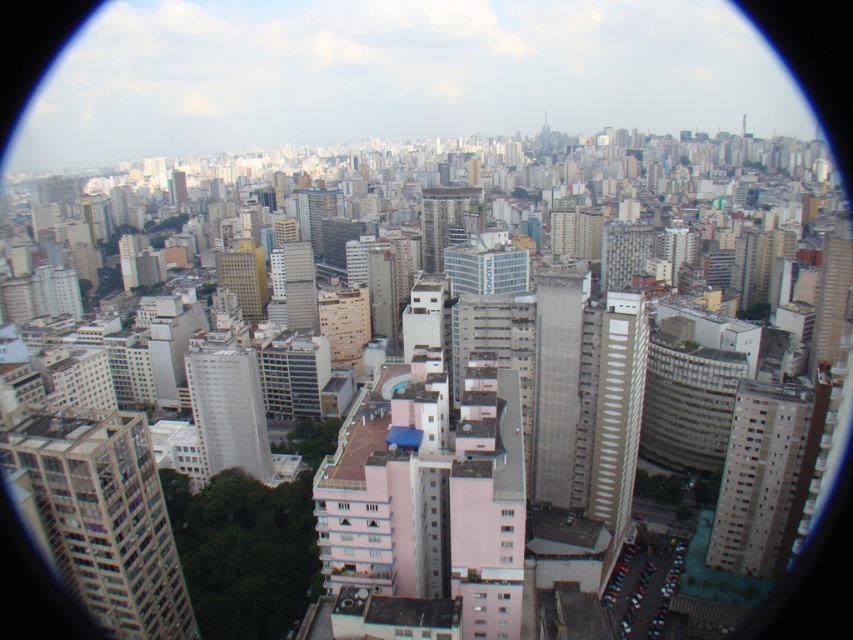
Who is taller, gray concrete building at center-right or light gray concrete building at center?

light gray concrete building at center is taller.

Can you confirm if gray concrete building at center-right is positioned to the left of light gray concrete building at center?

Incorrect, gray concrete building at center-right is not on the left side of light gray concrete building at center.

Is point (744, 540) behind point (457, 193)?

That is False.

The image size is (853, 640). What are the coordinates of `gray concrete building at center-right` in the screenshot? It's located at (758, 476).

Is white glass building at lower left positioned at the back of white smooth building at center?

That is False.

Does white glass building at lower left have a lesser width compared to white smooth building at center?

Indeed, white glass building at lower left has a lesser width compared to white smooth building at center.

This screenshot has width=853, height=640. I want to click on white glass building at lower left, so click(103, 516).

The height and width of the screenshot is (640, 853). What do you see at coordinates (103, 516) in the screenshot? I see `white glass building at lower left` at bounding box center [103, 516].

Can you confirm if white glass building at lower left is positioned to the right of light gray concrete building at center?

In fact, white glass building at lower left is to the left of light gray concrete building at center.

Locate an element on the screen. The height and width of the screenshot is (640, 853). white glass building at lower left is located at coordinates (103, 516).

Identify the location of white glass building at lower left. This screenshot has width=853, height=640. (103, 516).